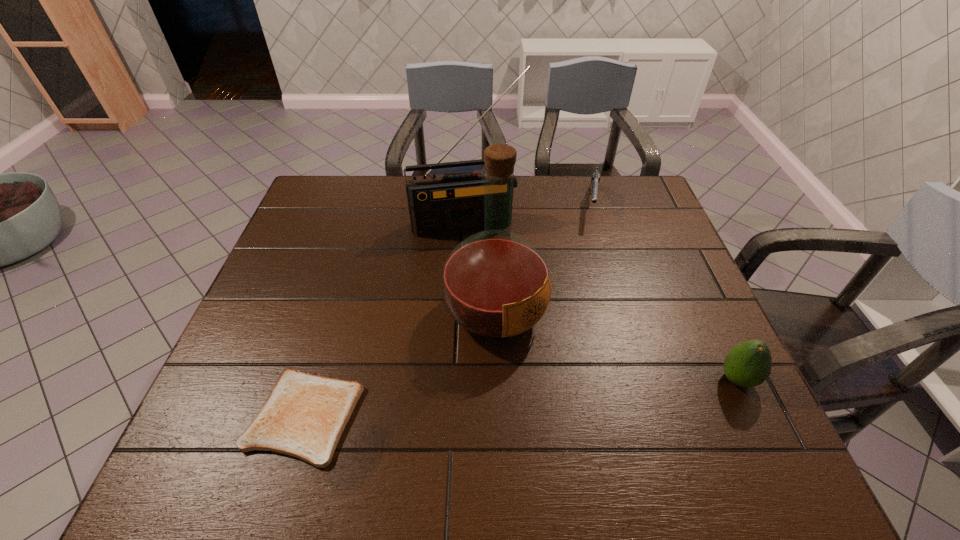
Find the location of `the shortest object`. the shortest object is located at coordinates (304, 416).

This screenshot has width=960, height=540. I want to click on toast, so click(304, 416).

Where is `the rightmost object`? Image resolution: width=960 pixels, height=540 pixels. the rightmost object is located at coordinates (749, 364).

Image resolution: width=960 pixels, height=540 pixels. Identify the location of avocado. (749, 364).

Find the location of a particular element. Image resolution: width=960 pixels, height=540 pixels. radio receiver is located at coordinates (438, 204).

The height and width of the screenshot is (540, 960). I want to click on liquor, so click(495, 284).

The height and width of the screenshot is (540, 960). I want to click on the second object from right to left, so [595, 179].

You are a GUI agent. You are given a task and a screenshot of the screen. Output one action in this format:
    pyautogui.click(x=<x>, y=<y>)
    Task: Click on the fourth tallest object
    
    Given the screenshot: What is the action you would take?
    pyautogui.click(x=595, y=179)

The width and height of the screenshot is (960, 540). Find the location of `vacant space located 0.080m on the right of the shortest object`. vacant space located 0.080m on the right of the shortest object is located at coordinates (397, 416).

This screenshot has height=540, width=960. I want to click on free spot located on the left of the third tallest object, so click(x=594, y=380).